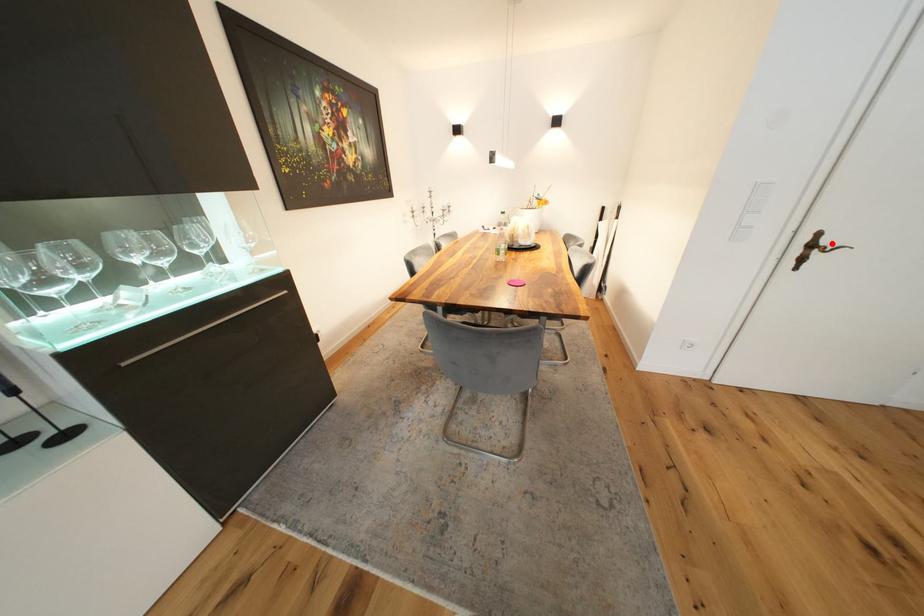
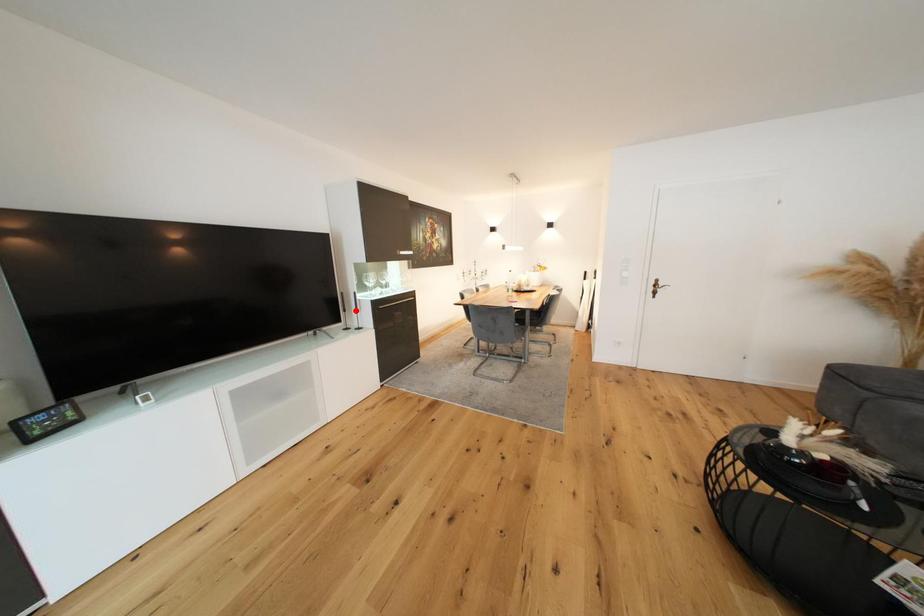
I am providing you with two images of the same scene from different viewpoints. A red point is marked on the first image and another point is marked on the second image. Is the marked point in image1 the same physical position as the marked point in image2?

No